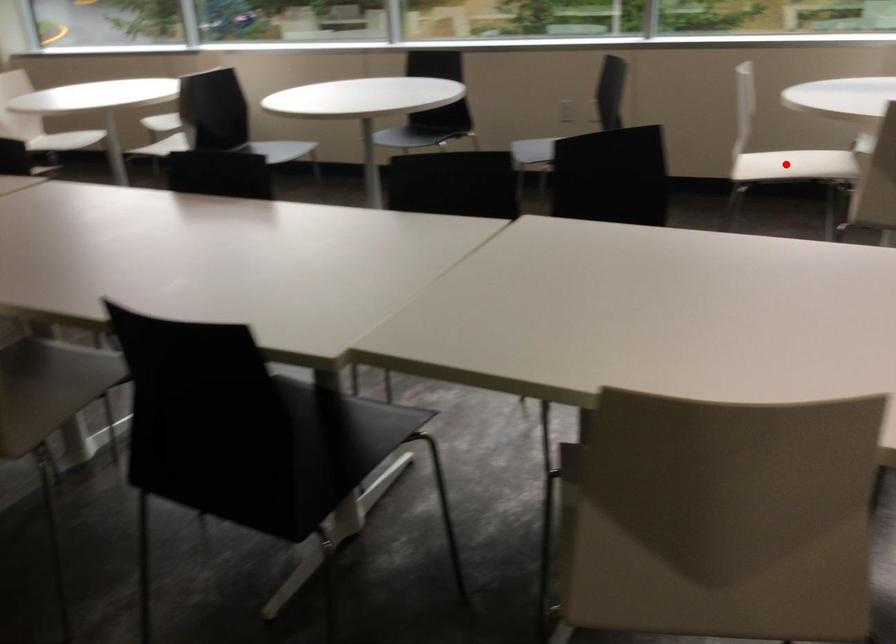
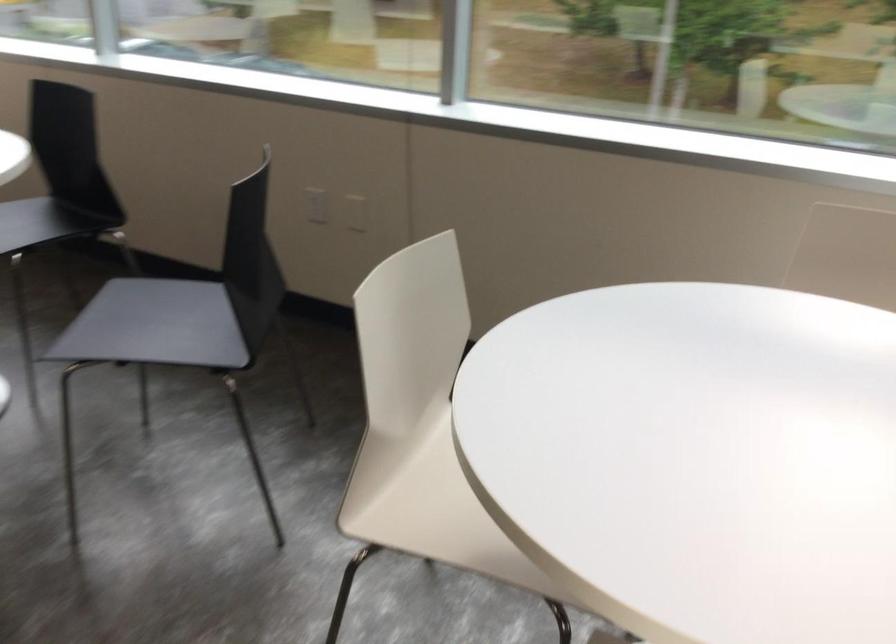
Question: I am providing you with two images of the same scene from different viewpoints. In image1, a red point is highlighted. Considering the same 3D point in image2, which of the following is correct?

Choices:
 (A) It is closer
 (B) It is farther

Answer: (A)